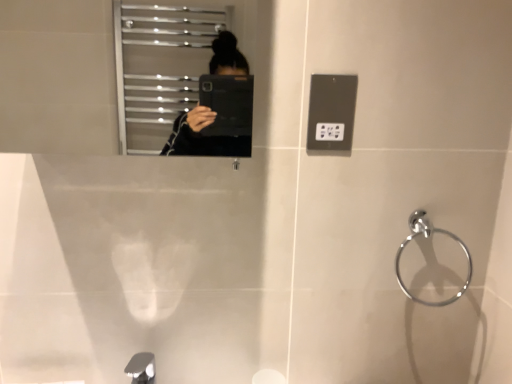
What do you see at coordinates (141, 368) in the screenshot? I see `silver metallic tap at lower left` at bounding box center [141, 368].

Locate an element on the screen. chrome metallic towel ring at right is located at coordinates (426, 238).

Considering the relative positions of metallic gray outlet at upper right and chrome metallic towel ring at right in the image provided, is metallic gray outlet at upper right to the left or to the right of chrome metallic towel ring at right?

metallic gray outlet at upper right is to the left of chrome metallic towel ring at right.

Is metallic gray outlet at upper right positioned behind chrome metallic towel ring at right?

No, it is in front of chrome metallic towel ring at right.

Is metallic gray outlet at upper right facing away from chrome metallic towel ring at right?

No, metallic gray outlet at upper right is not facing the opposite direction of chrome metallic towel ring at right.

Can you confirm if metallic gray outlet at upper right is thinner than chrome metallic towel ring at right?

Yes, metallic gray outlet at upper right is thinner than chrome metallic towel ring at right.

Is silver metallic tap at lower left in front of or behind metallic gray outlet at upper right in the image?

In the image, silver metallic tap at lower left appears in front of metallic gray outlet at upper right.

Which of these two, silver metallic tap at lower left or metallic gray outlet at upper right, is smaller?

With smaller size is metallic gray outlet at upper right.

Looking at this image, from the image's perspective, is silver metallic tap at lower left over metallic gray outlet at upper right?

Incorrect, from the image's perspective, silver metallic tap at lower left is lower than metallic gray outlet at upper right.

In the scene shown: Is the surface of silver metallic tap at lower left in direct contact with metallic gray outlet at upper right?

No.

Would you say chrome metallic towel ring at right is inside or outside silver metallic tap at lower left?

→ chrome metallic towel ring at right exists outside the volume of silver metallic tap at lower left.

Considering the positions of objects chrome metallic towel ring at right and silver metallic tap at lower left in the image provided, who is more to the right, chrome metallic towel ring at right or silver metallic tap at lower left?

chrome metallic towel ring at right is more to the right.

Is chrome metallic towel ring at right oriented away from silver metallic tap at lower left?

No, chrome metallic towel ring at right is not facing the opposite direction of silver metallic tap at lower left.

Is point (450, 234) closer or farther from the camera than point (134, 374)?

Point (450, 234) appears to be farther away from the viewer than point (134, 374).

From the picture: From the image's perspective, which object appears higher, silver metallic tap at lower left or chrome metallic towel ring at right?

From the image's view, chrome metallic towel ring at right is above.

In terms of height, does silver metallic tap at lower left look taller or shorter compared to chrome metallic towel ring at right?

silver metallic tap at lower left is shorter than chrome metallic towel ring at right.

Which is behind, point (135, 369) or point (434, 228)?

The point (434, 228) is behind.

Is silver metallic tap at lower left positioned far away from chrome metallic towel ring at right?

No.

This screenshot has height=384, width=512. What are the coordinates of `towel bar that is on the right side of metallic gray outlet at upper right` in the screenshot? It's located at (426, 238).

Between point (412, 221) and point (316, 118), which one is positioned in front?

The point (316, 118) is more forward.

From the picture: Is chrome metallic towel ring at right not close to metallic gray outlet at upper right?

No, chrome metallic towel ring at right is in close proximity to metallic gray outlet at upper right.

From a real-world perspective, who is located lower, metallic gray outlet at upper right or silver metallic tap at lower left?

silver metallic tap at lower left.

Considering the relative sizes of metallic gray outlet at upper right and silver metallic tap at lower left in the image provided, is metallic gray outlet at upper right bigger than silver metallic tap at lower left?

No, metallic gray outlet at upper right is not bigger than silver metallic tap at lower left.

Based on the photo, is metallic gray outlet at upper right directly adjacent to silver metallic tap at lower left?

No, metallic gray outlet at upper right is not making contact with silver metallic tap at lower left.

Between metallic gray outlet at upper right and silver metallic tap at lower left, which one is positioned in front?

silver metallic tap at lower left is closer to the camera.

This screenshot has height=384, width=512. I want to click on towel bar on the right of metallic gray outlet at upper right, so click(x=426, y=238).

Locate an element on the screen. This screenshot has width=512, height=384. tap on the left of metallic gray outlet at upper right is located at coordinates (141, 368).

Looking at this image, estimate the real-world distances between objects in this image. Which object is closer to chrome metallic towel ring at right, silver metallic tap at lower left or metallic gray outlet at upper right?

metallic gray outlet at upper right is positioned closer to the anchor chrome metallic towel ring at right.

From the picture: Looking at the image, which one is located further to silver metallic tap at lower left, chrome metallic towel ring at right or metallic gray outlet at upper right?

Based on the image, chrome metallic towel ring at right appears to be further to silver metallic tap at lower left.

From the image, which object appears to be nearer to silver metallic tap at lower left, metallic gray outlet at upper right or chrome metallic towel ring at right?

The object closer to silver metallic tap at lower left is metallic gray outlet at upper right.

Which object lies further to the anchor point chrome metallic towel ring at right, metallic gray outlet at upper right or silver metallic tap at lower left?

The object further to chrome metallic towel ring at right is silver metallic tap at lower left.

Which object lies nearer to the anchor point metallic gray outlet at upper right, silver metallic tap at lower left or chrome metallic towel ring at right?

chrome metallic towel ring at right is positioned closer to the anchor metallic gray outlet at upper right.

When comparing their distances from metallic gray outlet at upper right, does chrome metallic towel ring at right or silver metallic tap at lower left seem closer?

chrome metallic towel ring at right.

This screenshot has height=384, width=512. Find the location of `light switch situated between silver metallic tap at lower left and chrome metallic towel ring at right from left to right`. light switch situated between silver metallic tap at lower left and chrome metallic towel ring at right from left to right is located at coordinates (331, 112).